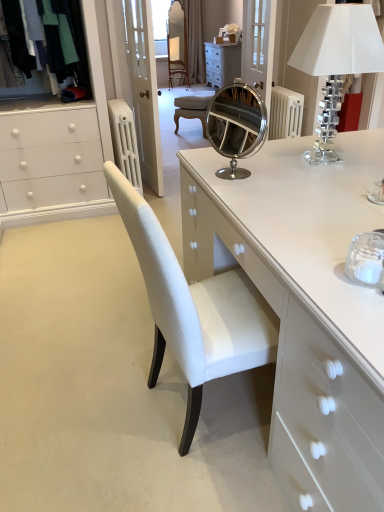
In order to click on white glossy chest of drawers at center in this screenshot , I will do pos(304,303).

Describe the element at coordinates (304, 303) in the screenshot. The height and width of the screenshot is (512, 384). I see `white glossy chest of drawers at center` at that location.

What do you see at coordinates (58, 38) in the screenshot? I see `velvet fabric clothes at upper left` at bounding box center [58, 38].

Locate an element on the screen. This screenshot has height=512, width=384. white painted metal radiator at upper left is located at coordinates (125, 141).

Find the location of a particular element. The image size is (384, 512). brown fabric curtain at upper center is located at coordinates (194, 40).

Considering their positions, is velvet fabric clothes at upper left located in front of or behind clear crystal lampshade at upper right?

Visually, velvet fabric clothes at upper left is located behind clear crystal lampshade at upper right.

Is velvet fabric clothes at upper left oriented away from clear crystal lampshade at upper right?

That's not correct — velvet fabric clothes at upper left is not looking away from clear crystal lampshade at upper right.

Consider the image. Can you confirm if velvet fabric clothes at upper left is positioned to the right of clear crystal lampshade at upper right?

In fact, velvet fabric clothes at upper left is to the left of clear crystal lampshade at upper right.

From the image's perspective, is velvet fabric clothes at upper left located beneath clear crystal lampshade at upper right?

Actually, velvet fabric clothes at upper left appears above clear crystal lampshade at upper right in the image.

From the image's perspective, relative to brown fabric curtain at upper center, is velvet fabric clothes at upper left above or below?

velvet fabric clothes at upper left is situated lower than brown fabric curtain at upper center in the image.

Does point (22, 52) come behind point (192, 15)?

No, it is not.

In the image, is velvet fabric clothes at upper left positioned in front of or behind brown fabric curtain at upper center?

velvet fabric clothes at upper left is in front of brown fabric curtain at upper center.

Looking at this image, considering the relative positions of velvet fabric clothes at upper left and brown fabric curtain at upper center in the image provided, is velvet fabric clothes at upper left to the left of brown fabric curtain at upper center from the viewer's perspective?

Indeed, velvet fabric clothes at upper left is positioned on the left side of brown fabric curtain at upper center.

Does velvet fabric clothes at upper left lie behind white painted metal radiator at upper left?

That is False.

At what (x,y) coordinates should I click in order to perform the action: click on clothing located above the white painted metal radiator at upper left (from a real-world perspective). Please return your answer as a coordinate pair (x, y). The height and width of the screenshot is (512, 384). Looking at the image, I should click on click(58, 38).

Based on the photo, is velvet fabric clothes at upper left in contact with white painted metal radiator at upper left?

No.

Is white painted metal radiator at upper left inside velvet fabric clothes at upper left?

→ Actually, white painted metal radiator at upper left is outside velvet fabric clothes at upper left.

Find the location of a particular element. The image size is (384, 512). the chest of drawers beneath the white painted metal radiator at upper left (from a real-world perspective) is located at coordinates (304, 303).

Is white glossy chest of drawers at center positioned beyond the bounds of white painted metal radiator at upper left?

Yes, white glossy chest of drawers at center is located beyond the bounds of white painted metal radiator at upper left.

Between white glossy chest of drawers at center and white painted metal radiator at upper left, which one is positioned behind?

white painted metal radiator at upper left.

From a real-world perspective, does white glossy chest of drawers at center stand above white painted metal radiator at upper left?

No.

Which object is further away from the camera taking this photo, clear glass door at upper center or white glossy chest of drawers at center?

clear glass door at upper center is behind.

Is white glossy chest of drawers at center at the back of clear glass door at upper center?

No, clear glass door at upper center is not facing the opposite direction of white glossy chest of drawers at center.

Can you confirm if clear glass door at upper center is bigger than white glossy chest of drawers at center?

No, clear glass door at upper center is not bigger than white glossy chest of drawers at center.

From a real-world perspective, between clear glass door at upper center and white glossy chest of drawers at center, who is vertically lower?

white glossy chest of drawers at center, from a real-world perspective.

Can you confirm if white painted metal radiator at upper left is shorter than clear crystal lampshade at upper right?

No, white painted metal radiator at upper left is not shorter than clear crystal lampshade at upper right.

From the image's perspective, does white painted metal radiator at upper left appear higher than clear crystal lampshade at upper right?

Indeed, from the image's perspective, white painted metal radiator at upper left is shown above clear crystal lampshade at upper right.

Considering the positions of points (129, 115) and (369, 32), is point (129, 115) farther from camera compared to point (369, 32)?

Yes.

Is velvet fabric clothes at upper left a part of brown fabric curtain at upper center?

No, velvet fabric clothes at upper left is not surrounded by brown fabric curtain at upper center.

Is brown fabric curtain at upper center thinner than velvet fabric clothes at upper left?

Yes.

Is brown fabric curtain at upper center smaller than velvet fabric clothes at upper left?

Incorrect, brown fabric curtain at upper center is not smaller in size than velvet fabric clothes at upper left.

From the image's perspective, relative to velvet fabric clothes at upper left, is brown fabric curtain at upper center above or below?

brown fabric curtain at upper center is above velvet fabric clothes at upper left.

In order to click on clothing located above the clear crystal lampshade at upper right (from a real-world perspective) in this screenshot , I will do `click(58, 38)`.

The width and height of the screenshot is (384, 512). In order to click on clothing in front of the brown fabric curtain at upper center in this screenshot , I will do `click(58, 38)`.

Looking at the image, which one is located closer to velvet fabric clothes at upper left, brown fabric curtain at upper center or clear glass door at upper center?

The object closer to velvet fabric clothes at upper left is clear glass door at upper center.

Which object lies nearer to the anchor point brown fabric curtain at upper center, white glossy chest of drawers at center or velvet fabric clothes at upper left?

velvet fabric clothes at upper left is positioned closer to the anchor brown fabric curtain at upper center.

When comparing their distances from white painted metal radiator at upper left, does brown fabric curtain at upper center or clear crystal lampshade at upper right seem closer?

clear crystal lampshade at upper right.

Which object lies further to the anchor point white painted metal radiator at upper left, clear glass door at upper center or white glossy chest of drawers at center?

Based on the image, clear glass door at upper center appears to be further to white painted metal radiator at upper left.

Considering their positions, is clear glass door at upper center positioned further to velvet fabric clothes at upper left than white painted metal radiator at upper left?

clear glass door at upper center.

When comparing their distances from velvet fabric clothes at upper left, does white painted metal radiator at upper left or brown fabric curtain at upper center seem closer?

white painted metal radiator at upper left is closer to velvet fabric clothes at upper left.

Consider the image. Which object lies further to the anchor point clear crystal lampshade at upper right, white painted metal radiator at upper left or white glossy chest of drawers at center?

white painted metal radiator at upper left.

In the scene shown: From the image, which object appears to be farther from clear glass door at upper center, white glossy chest of drawers at center or velvet fabric clothes at upper left?

Among the two, white glossy chest of drawers at center is located further to clear glass door at upper center.

This screenshot has height=512, width=384. I want to click on glass door between velvet fabric clothes at upper left and brown fabric curtain at upper center along the z-axis, so click(x=257, y=42).

What are the coordinates of `radiator between velvet fabric clothes at upper left and brown fabric curtain at upper center from front to back` in the screenshot? It's located at (125, 141).

In order to click on clothing between white glossy chest of drawers at center and white painted metal radiator at upper left in the front-back direction in this screenshot , I will do `click(58, 38)`.

The width and height of the screenshot is (384, 512). What are the coordinates of `clothing positioned between white glossy chest of drawers at center and brown fabric curtain at upper center from near to far` in the screenshot? It's located at (58, 38).